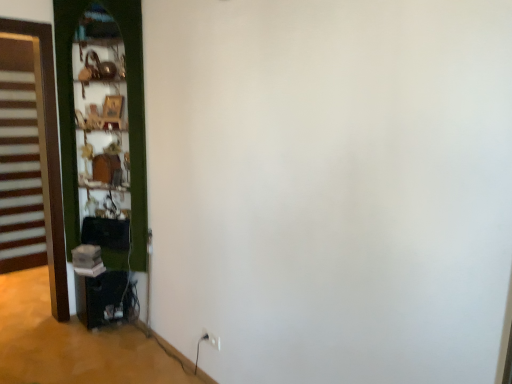
Question: From the image's perspective, is brown wooden door at left, the 1th door viewed from the left, located above or below green wooden door at left, acting as the 1th door starting from the right?

Choices:
 (A) below
 (B) above

Answer: (A)

Question: From a real-world perspective, relative to green wooden door at left, arranged as the 2th door when viewed from the left, is brown wooden door at left, positioned as the second door in right-to-left order, vertically above or below?

Choices:
 (A) above
 (B) below

Answer: (B)

Question: Which object is the closest to the brown wooden door at left, the 1th door viewed from the left?

Choices:
 (A) green wooden door at left, acting as the 1th door starting from the right
 (B) white plastic electric outlet at lower center

Answer: (A)

Question: Estimate the real-world distances between objects in this image. Which object is farther from the white plastic electric outlet at lower center?

Choices:
 (A) green wooden door at left, acting as the 1th door starting from the right
 (B) brown wooden door at left, the 1th door viewed from the left

Answer: (B)